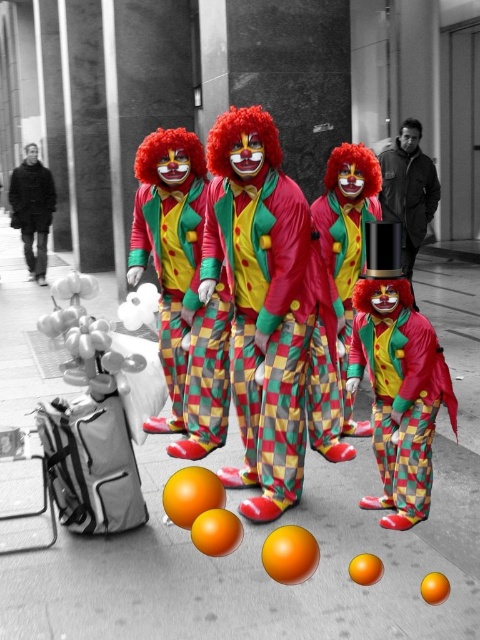
Question: Which point is farther to the camera?

Choices:
 (A) smooth concrete pavement at center
 (B) matte clown at center

Answer: (B)

Question: In this image, where is smooth concrete pavement at center located relative to matte clown at center?

Choices:
 (A) left
 (B) right

Answer: (A)

Question: Among these objects, which one is nearest to the camera?

Choices:
 (A) matte clown at center
 (B) smooth concrete pavement at center

Answer: (B)

Question: Is smooth concrete pavement at center wider than matte clown at center?

Choices:
 (A) no
 (B) yes

Answer: (B)

Question: Which point is farther to the camera?

Choices:
 (A) smooth concrete pavement at center
 (B) matte clown at center

Answer: (B)

Question: In this image, where is smooth concrete pavement at center located relative to matte clown at center?

Choices:
 (A) above
 (B) below

Answer: (B)